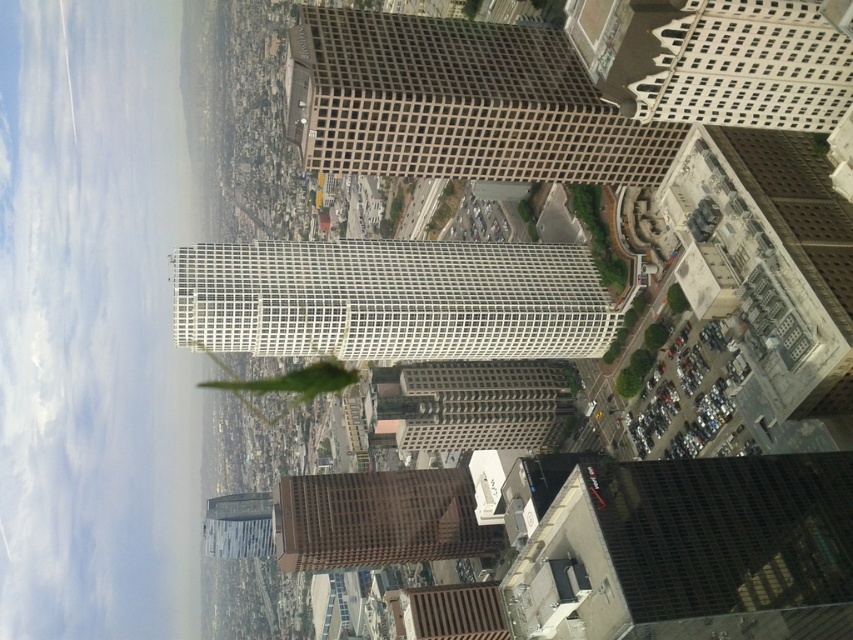
Does green matte tower at center appear on the left side of white glassy skyscraper at center?

No, green matte tower at center is not to the left of white glassy skyscraper at center.

Is point (297, 33) positioned in front of point (479, 349)?

Yes.

Where is `green matte tower at center`? green matte tower at center is located at coordinates (457, 102).

Can you confirm if green matte tower at center is wider than white textured building at upper right?

Indeed, green matte tower at center has a greater width compared to white textured building at upper right.

Can you confirm if green matte tower at center is positioned to the left of white textured building at upper right?

Yes, green matte tower at center is to the left of white textured building at upper right.

Is point (666, 164) positioned before point (712, 61)?

No, it is not.

At what (x,y) coordinates should I click in order to perform the action: click on green matte tower at center. Please return your answer as a coordinate pair (x, y). The image size is (853, 640). Looking at the image, I should click on (x=457, y=102).

Is point (582, 275) behind point (815, 4)?

Yes, it is behind point (815, 4).

Between white glassy skyscraper at center and white textured building at upper right, which one appears on the left side from the viewer's perspective?

Positioned to the left is white glassy skyscraper at center.

Which is in front, point (463, 323) or point (756, 108)?

Point (756, 108) is more forward.

Locate an element on the screen. white glassy skyscraper at center is located at coordinates (392, 300).